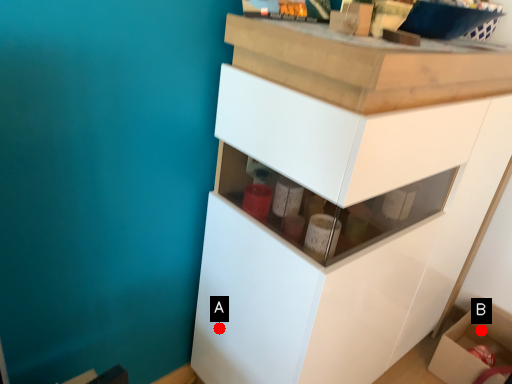
Question: Two points are circled on the image, labeled by A and B beside each circle. Which point appears closest to the camera in this image?

Choices:
 (A) A is closer
 (B) B is closer

Answer: (A)